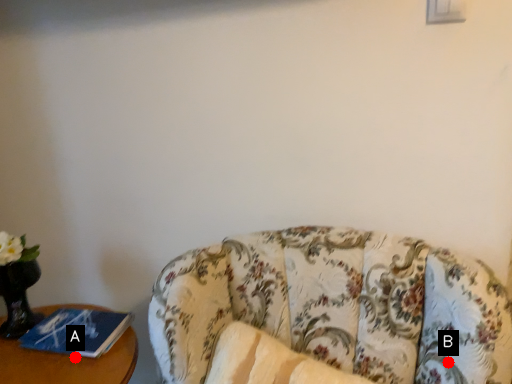
Question: Two points are circled on the image, labeled by A and B beside each circle. Which point appears closest to the camera in this image?

Choices:
 (A) A is closer
 (B) B is closer

Answer: (B)